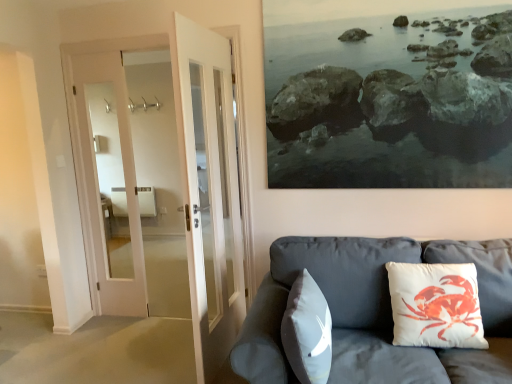
Question: Is matte gray couch at lower right bigger than white cotton cushion with crab print at right, the 1th pillow viewed from the right?

Choices:
 (A) yes
 (B) no

Answer: (A)

Question: Can you confirm if matte gray couch at lower right is thinner than white cotton cushion with crab print at right, which is counted as the 2th pillow, starting from the left?

Choices:
 (A) yes
 (B) no

Answer: (B)

Question: Is matte gray couch at lower right touching white cotton cushion with crab print at right, which is counted as the 2th pillow, starting from the left?

Choices:
 (A) yes
 (B) no

Answer: (B)

Question: Is matte gray couch at lower right closer to the viewer compared to white cotton cushion with crab print at right, which is counted as the 2th pillow, starting from the left?

Choices:
 (A) no
 (B) yes

Answer: (B)

Question: Is matte gray couch at lower right turned away from white cotton cushion with crab print at right, the 1th pillow viewed from the right?

Choices:
 (A) no
 (B) yes

Answer: (B)

Question: Considering the positions of point (485, 345) and point (321, 278), is point (485, 345) closer or farther from the camera than point (321, 278)?

Choices:
 (A) farther
 (B) closer

Answer: (B)

Question: Considering the positions of white cotton cushion with crab print at right, which is counted as the 2th pillow, starting from the left, and matte gray couch at lower right in the image, is white cotton cushion with crab print at right, which is counted as the 2th pillow, starting from the left, taller or shorter than matte gray couch at lower right?

Choices:
 (A) short
 (B) tall

Answer: (A)

Question: Based on their sizes in the image, would you say white cotton cushion with crab print at right, the 1th pillow viewed from the right, is bigger or smaller than matte gray couch at lower right?

Choices:
 (A) big
 (B) small

Answer: (B)

Question: Based on their positions, is white cotton cushion with crab print at right, the 1th pillow viewed from the right, located to the left or right of matte gray couch at lower right?

Choices:
 (A) right
 (B) left

Answer: (A)

Question: From a real-world perspective, relative to white matte pillow at center, the 1th pillow when ordered from left to right, is white cotton cushion with crab print at right, which is counted as the 2th pillow, starting from the left, vertically above or below?

Choices:
 (A) below
 (B) above

Answer: (B)

Question: Is point (394, 309) positioned closer to the camera than point (326, 331)?

Choices:
 (A) farther
 (B) closer

Answer: (A)

Question: In terms of size, does white cotton cushion with crab print at right, the 1th pillow viewed from the right, appear bigger or smaller than white matte pillow at center, acting as the second pillow starting from the right?

Choices:
 (A) small
 (B) big

Answer: (A)

Question: In terms of width, does white cotton cushion with crab print at right, which is counted as the 2th pillow, starting from the left, look wider or thinner when compared to white matte pillow at center, the 1th pillow when ordered from left to right?

Choices:
 (A) wide
 (B) thin

Answer: (A)

Question: Considering the positions of white matte pillow at center, acting as the second pillow starting from the right, and matte gray couch at lower right in the image, is white matte pillow at center, acting as the second pillow starting from the right, bigger or smaller than matte gray couch at lower right?

Choices:
 (A) big
 (B) small

Answer: (B)

Question: Relative to matte gray couch at lower right, is white matte pillow at center, acting as the second pillow starting from the right, in front or behind?

Choices:
 (A) front
 (B) behind

Answer: (B)